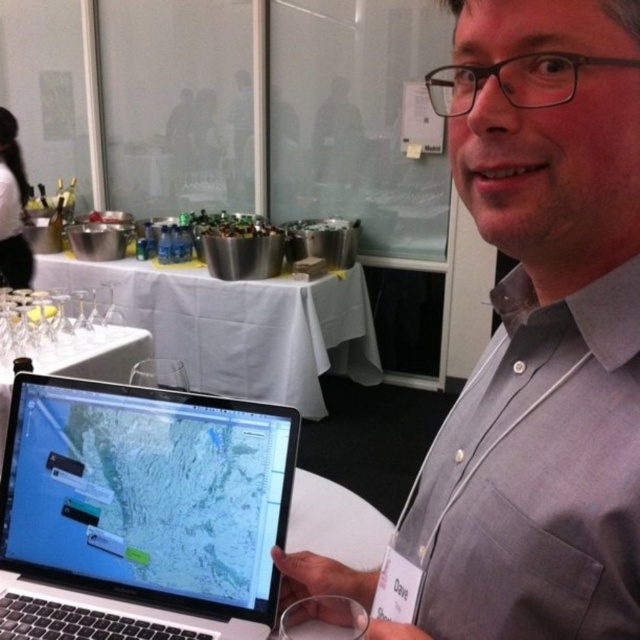
Between point (616, 115) and point (339, 323), which one is positioned behind?

The point (339, 323) is more distant.

Identify the location of gray cotton shirt at center. (531, 346).

This screenshot has width=640, height=640. I want to click on gray cotton shirt at center, so click(x=531, y=346).

I want to click on gray cotton shirt at center, so click(531, 346).

Is gray cotton shirt at center positioned before satin black laptop at lower left?

Yes, gray cotton shirt at center is closer to the viewer.

The image size is (640, 640). I want to click on gray cotton shirt at center, so click(x=531, y=346).

Is satin black laptop at lower left positioned before white cloth table at center?

Yes.

Can you confirm if satin black laptop at lower left is smaller than white cloth table at center?

Indeed, satin black laptop at lower left has a smaller size compared to white cloth table at center.

Image resolution: width=640 pixels, height=640 pixels. What do you see at coordinates (141, 509) in the screenshot?
I see `satin black laptop at lower left` at bounding box center [141, 509].

At what (x,y) coordinates should I click in order to perform the action: click on satin black laptop at lower left. Please return your answer as a coordinate pair (x, y). The width and height of the screenshot is (640, 640). Looking at the image, I should click on (141, 509).